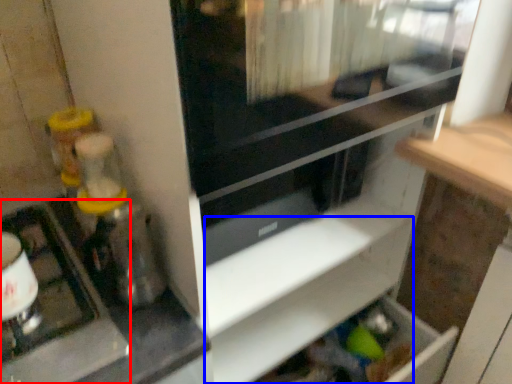
Question: Which object appears farthest to the camera in this image, appliance (highlighted by a red box) or shelf (highlighted by a blue box)?

Choices:
 (A) appliance
 (B) shelf

Answer: (B)